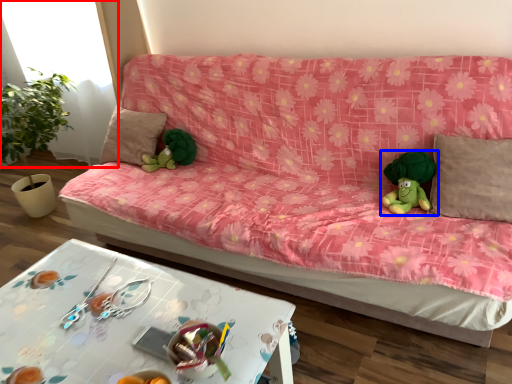
Question: Which of the following is the closest to the observer, window (highlighted by a red box) or toy (highlighted by a blue box)?

Choices:
 (A) window
 (B) toy

Answer: (B)